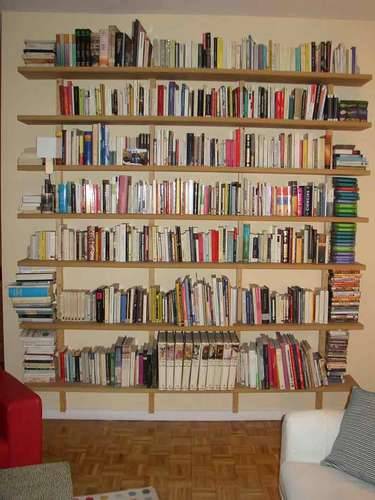
The height and width of the screenshot is (500, 375). Identify the location of ceiling. (241, 2).